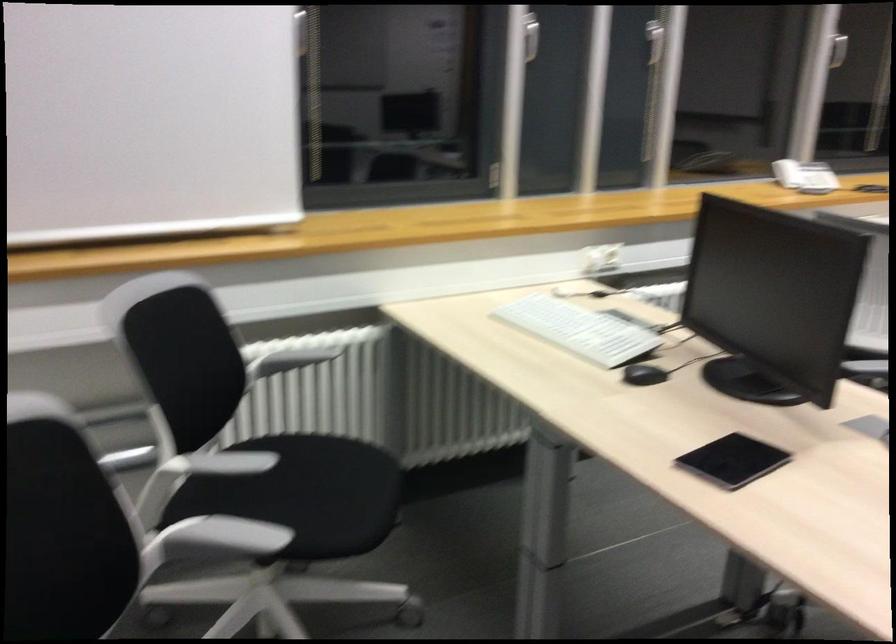
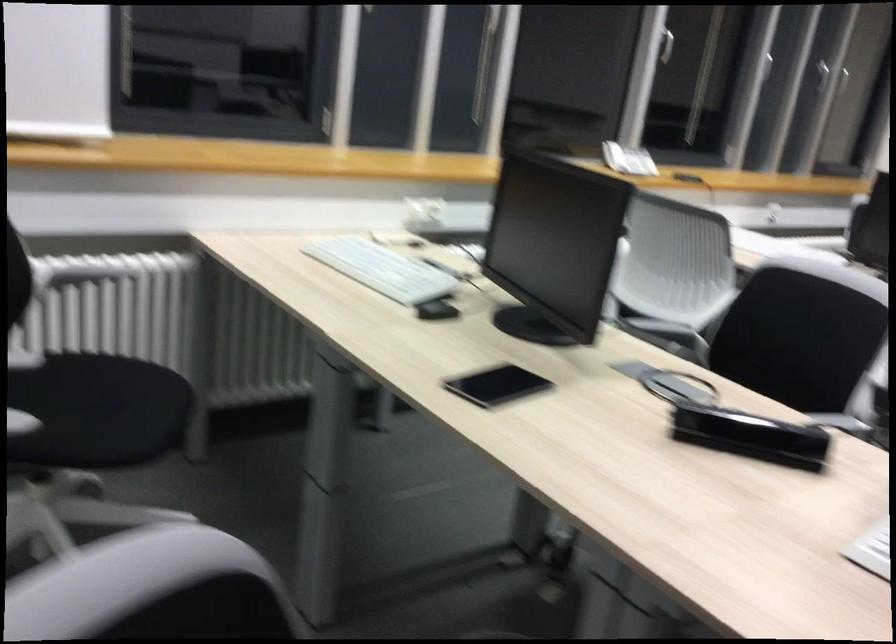
The point at (794, 169) is marked in the first image. Where is the corresponding point in the second image?

(614, 156)